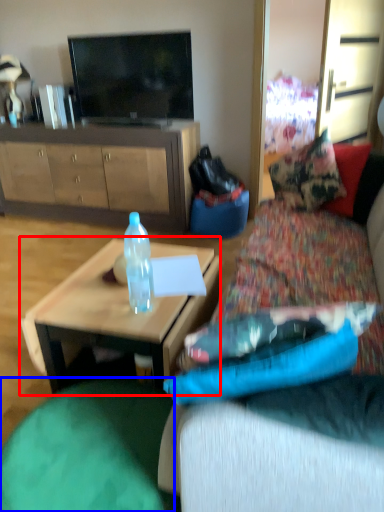
Question: Which point is closer to the camera, coffee table (highlighted by a red box) or bean bag chair (highlighted by a blue box)?

Choices:
 (A) coffee table
 (B) bean bag chair

Answer: (B)